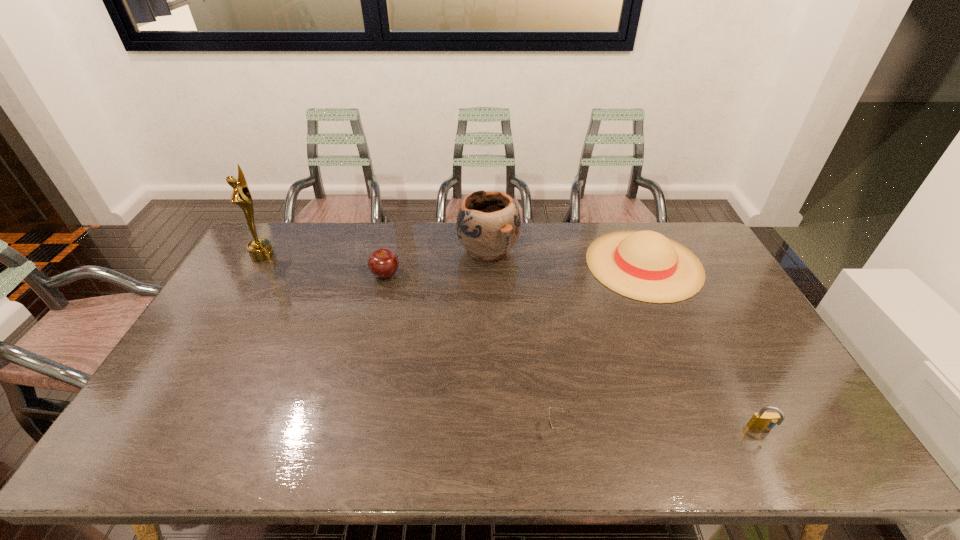
Where is `free location located 0.140m on the left of the fifth shortest object`? The image size is (960, 540). free location located 0.140m on the left of the fifth shortest object is located at coordinates (419, 249).

Find the location of a particular element. This screenshot has width=960, height=540. vacant position located on the front of the sombrero is located at coordinates (669, 320).

You are a GUI agent. You are given a task and a screenshot of the screen. Output one action in this format:
    pyautogui.click(x=<x>, y=<y>)
    Task: Click on the vacant space situated 0.170m on the left of the apple
    This screenshot has height=540, width=960.
    Given the screenshot: What is the action you would take?
    pyautogui.click(x=321, y=274)

In order to click on vacant region located in front of the lenses of the shortest object in this screenshot , I will do `click(505, 429)`.

Locate an element on the screen. The image size is (960, 540). free point located in front of the lenses of the shortest object is located at coordinates (484, 429).

You are a GUI agent. You are given a task and a screenshot of the screen. Output one action in this format:
    pyautogui.click(x=<x>, y=<y>)
    Task: Click on the vacant region located in front of the lenses of the shortest object
    
    Given the screenshot: What is the action you would take?
    pyautogui.click(x=401, y=429)

The width and height of the screenshot is (960, 540). Identify the location of award at the far edge. (260, 249).

Locate an element on the screen. pottery located at the far edge is located at coordinates (488, 225).

Find the location of a particular element. sombrero positioned at the far edge is located at coordinates (645, 265).

Where is `padlock positioned at the near edge`? padlock positioned at the near edge is located at coordinates (763, 420).